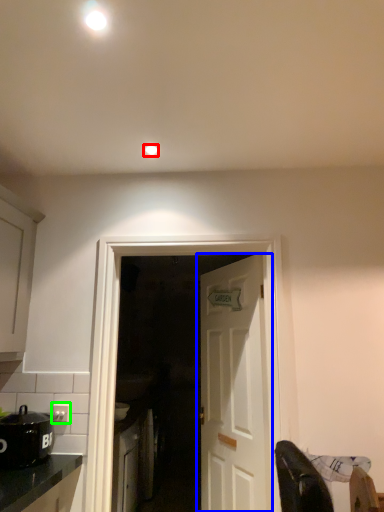
Question: Based on their relative distances, which object is nearer to lighting (highlighted by a red box)? Choose from door (highlighted by a blue box) and electric outlet (highlighted by a green box).

Choices:
 (A) door
 (B) electric outlet

Answer: (B)